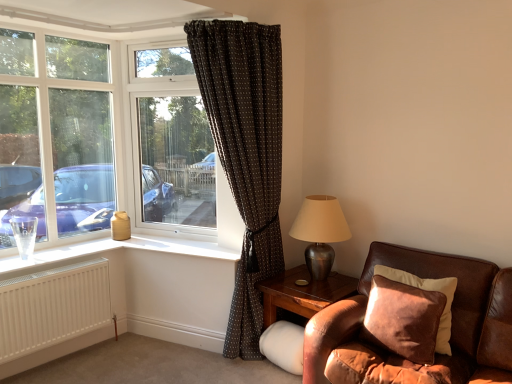
Image resolution: width=512 pixels, height=384 pixels. What are the coordinates of `free point above white matte radiator at lower left (from a real-world perspective)` in the screenshot? It's located at (55, 271).